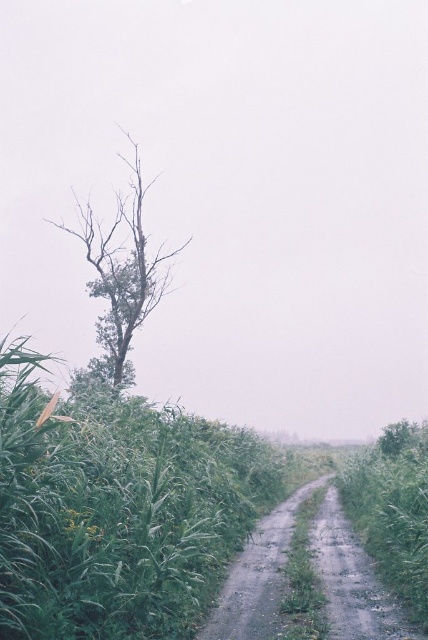
Question: In this image, where is green leafy tree at center located relative to dull gray gravel path at center?

Choices:
 (A) below
 (B) above

Answer: (B)

Question: Which of the following is the closest to the observer?

Choices:
 (A) green leafy tree at center
 (B) dull gray gravel path at center
 (C) green leafy corn field at left

Answer: (C)

Question: Is green leafy tree at center wider than dull gray gravel path at center?

Choices:
 (A) no
 (B) yes

Answer: (B)

Question: Which object is positioned farthest from the green leafy tree at center?

Choices:
 (A) dull gray gravel path at center
 (B) green leafy corn field at left

Answer: (A)

Question: Which object is farther from the camera taking this photo?

Choices:
 (A) dull gray gravel path at center
 (B) green leafy corn field at left
 (C) green leafy tree at center

Answer: (C)

Question: From the image, what is the correct spatial relationship of green leafy corn field at left in relation to green leafy tree at center?

Choices:
 (A) above
 (B) below

Answer: (B)